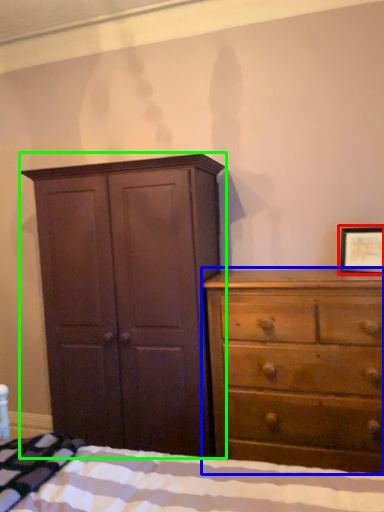
Question: Considering the real-world distances, which object is farthest from picture frame (highlighted by a red box)? chest of drawers (highlighted by a blue box) or cupboard (highlighted by a green box)?

Choices:
 (A) chest of drawers
 (B) cupboard

Answer: (B)